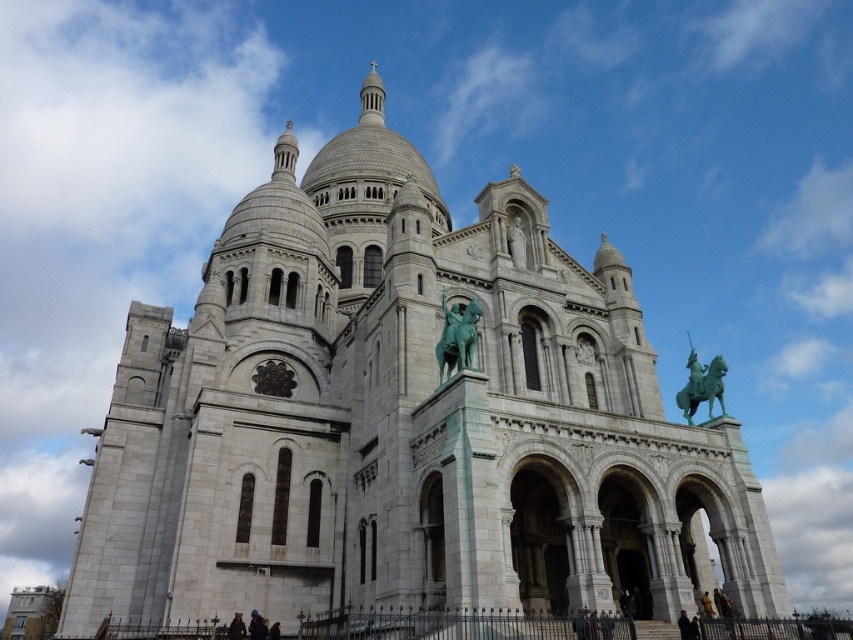
You are an art student trying to sketch the Basilica of the Sacred Heart of Paris. You notice two green patina statues in the scene. One is the green patina statue at center and the other is the green patina horse at upper right. Which statue should you focus on first if you want to draw them in the order they appear closest to you?

The green patina statue at center is closer to the viewer than the green patina horse at upper right, so you should focus on drawing the green patina statue at center first.

Based on the photo, you are a tourist standing at the base of the Sacre Coeur Basilica. You notice two green patina statues. One is the green patina statue at center and the other is the green patina horse at upper right. Which one is positioned higher up in the image?

The green patina statue at center is positioned higher up in the image than the green patina horse at upper right.

You are a tourist standing at the base of the Sacre Coeur Basilica. You see the green patina statue at center and the green patina horse at upper right. Which of these two objects is located to the left of the other?

The green patina statue at center is positioned on the left side of green patina horse at upper right.